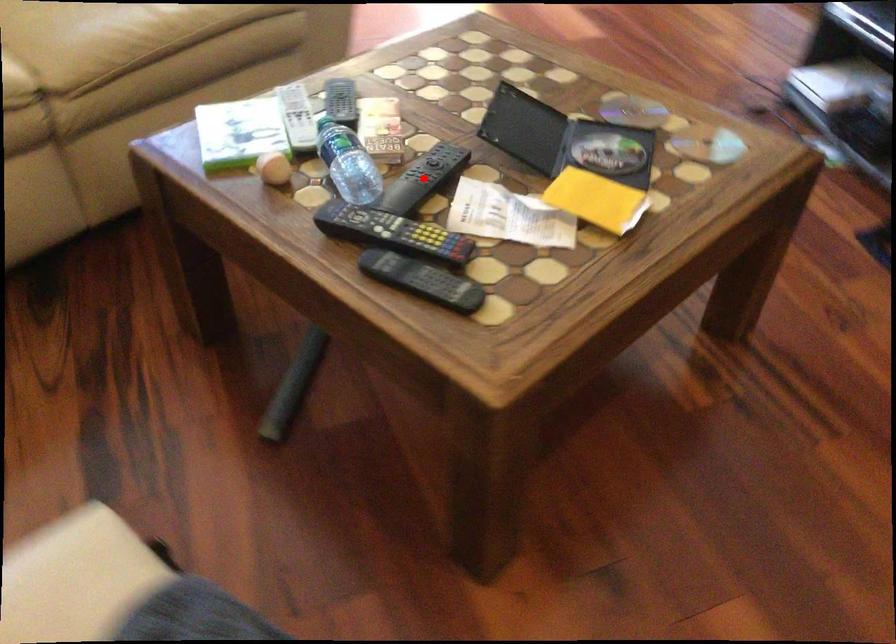
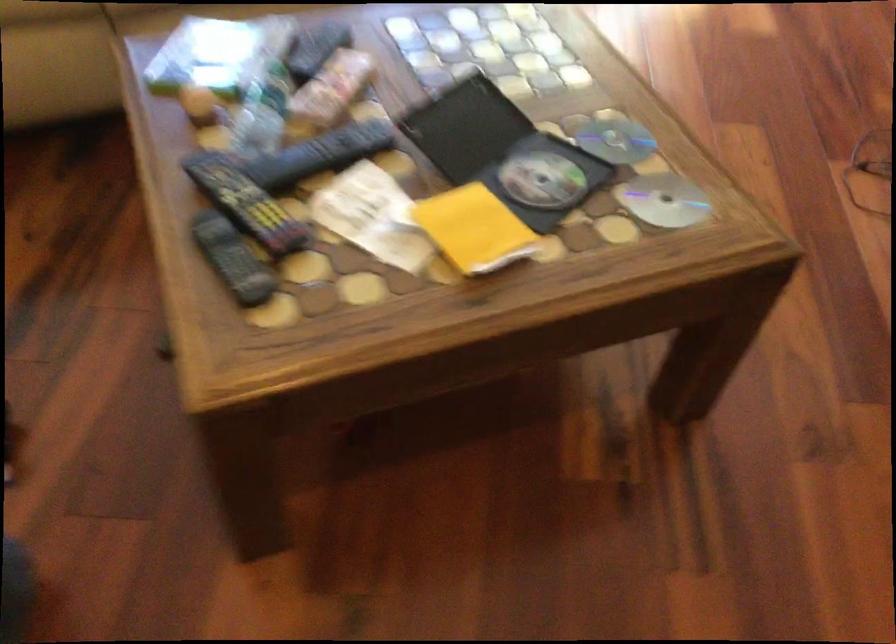
Question: I am providing you with two images of the same scene from different viewpoints. A red point is marked on the first image. At the location where the point appears in image 1, is it still visible in image 2?

Choices:
 (A) Yes
 (B) No

Answer: (A)